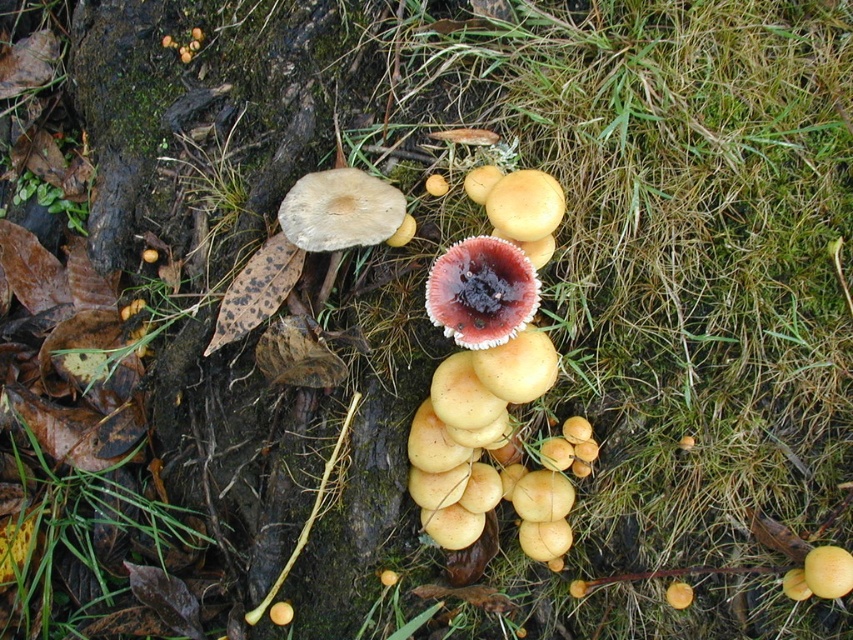
You are standing at the base of the log where the mushrooms are growing. You see two points marked in the image. The first point is at coordinates point (x=532, y=205), and the second point is at point (x=379, y=228). If you were to walk towards the log, which point would you encounter first?

Point (x=532, y=205) is in front of point (x=379, y=228), so you would encounter point (x=532, y=205) first as you walk towards the log.